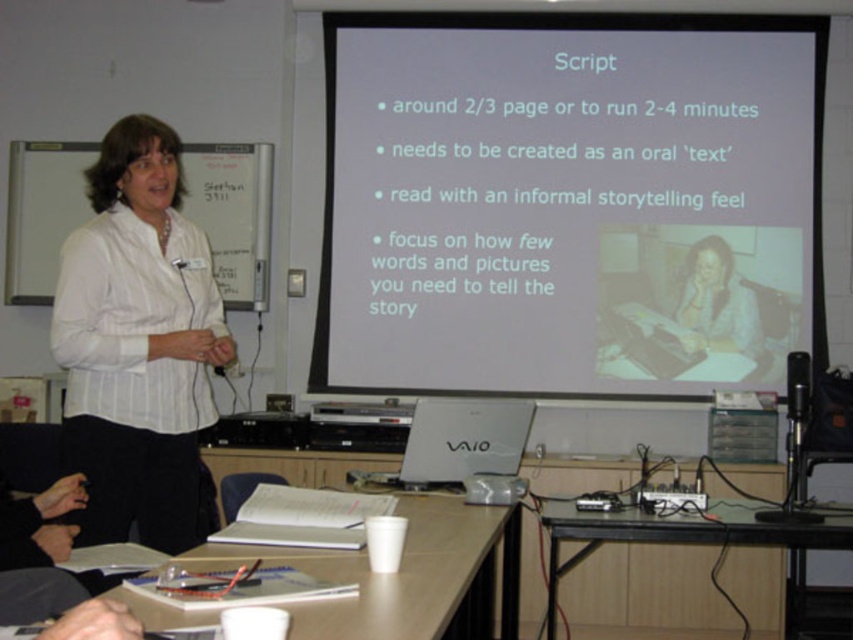
You are a student sitting at the back of the classroom and want to read the slide on the white matte projector screen at center. The classroom has a rule that students must stay at least 3 meters away from the screen to avoid disturbing the presentation. Can you move closer to the screen to read it better?

The white matte projector screen at center is 4.06 meters away from viewer. Since the minimum required distance is 3 meters, you can move closer to the screen as long as you stay at least 3 meters away, which is possible because the current distance is 4.06 meters.

You are standing in the classroom and want to hand a note to the presenter wearing the white shirt at center. If your arm can reach 3 feet, can you reach them?

The white shirt at center and viewer are 7.88 feet apart from each other, so no, your arm cannot reach them since it can only extend 3 feet.

You are a student sitting in the classroom and want to take a photo of the white matte projector screen at center and the white shirt at center. Which one should you point your camera at first if you want to capture both in the same frame without moving the camera?

You should point your camera at the white shirt at center first because the white matte projector screen at center is to the right of the white shirt at center, so by centering the white shirt at center, the screen will also be within the frame to its right.